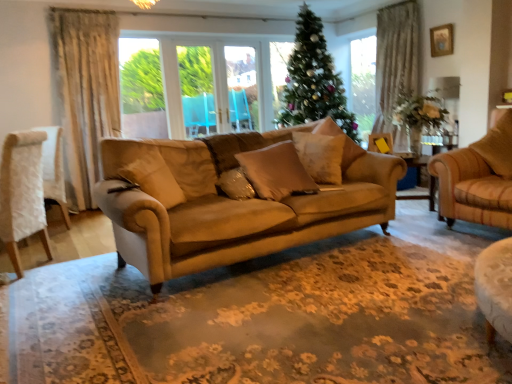
Question: From a real-world perspective, is satin beige pillow at center, arranged as the 3th pillow when viewed from the right, above or below satin gold pillow at center, which appears as the 2th pillow when viewed from the left?

Choices:
 (A) above
 (B) below

Answer: (A)

Question: In terms of height, does satin beige pillow at center, the 4th pillow in the left-to-right sequence, look taller or shorter compared to satin gold pillow at center, which appears as the 2th pillow when viewed from the left?

Choices:
 (A) short
 (B) tall

Answer: (B)

Question: Which is nearer to the wooden picture frame at upper right?

Choices:
 (A) white fabric chair at left
 (B) suede-like beige pillow at center, acting as the 2th pillow starting from the right
 (C) green metallic christmas tree at center
 (D) satin beige pillow at center, which is the 3th pillow from left to right
 (E) beige fabric pillow at right, which is the first pillow from right to left

Answer: (C)

Question: Which is nearer to the beige fabric pillow at right, the 6th pillow when ordered from left to right?

Choices:
 (A) suede-like beige pillow at center, acting as the 2th pillow starting from the right
 (B) satin gold pillow at center, which appears as the 2th pillow when viewed from the left
 (C) white fabric chair at left
 (D) satin beige pillow at center, the 4th pillow in the left-to-right sequence
 (E) beige fabric pillow at center, which is the first pillow from left to right

Answer: (A)